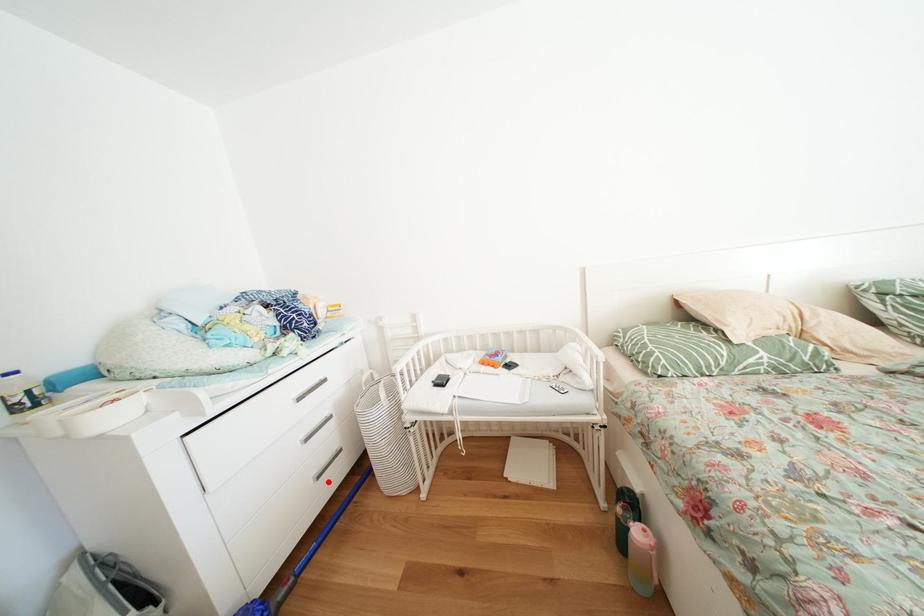
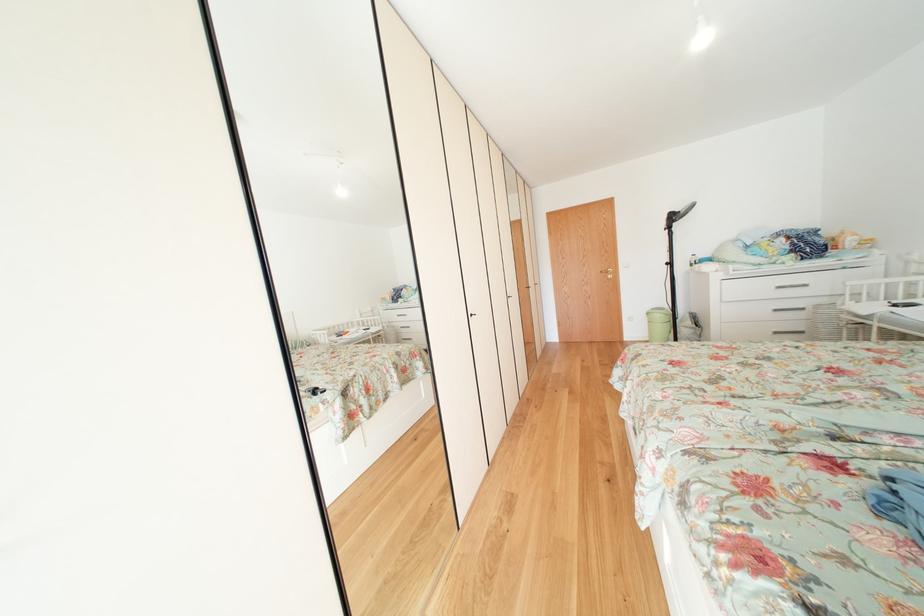
Locate, in the second image, the point that corresponds to the highlighted location in the first image.

(784, 338)